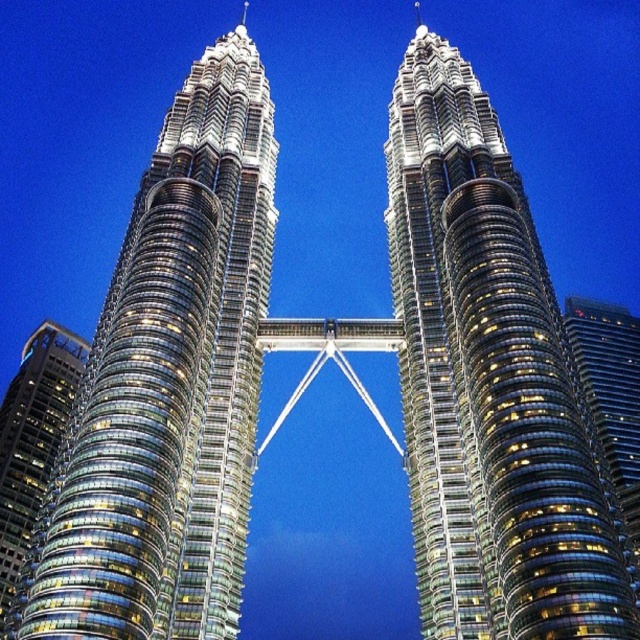
Question: Which point is farther to the camera?

Choices:
 (A) (36, 416)
 (B) (227, 388)
 (C) (406, 88)

Answer: (A)

Question: Is glassy metallic skyscraper at center above glassy steel skyscraper at center?

Choices:
 (A) no
 (B) yes

Answer: (B)

Question: Which object appears farthest from the camera in this image?

Choices:
 (A) glassy steel skyscraper at left
 (B) glassy steel skyscraper at center
 (C) glassy metallic skyscraper at center

Answer: (A)

Question: Which of the following is the farthest from the observer?

Choices:
 (A) glassy steel skyscraper at center
 (B) glassy steel skyscraper at left
 (C) glassy metallic skyscraper at center

Answer: (B)

Question: Can you confirm if glassy steel skyscraper at center is bigger than glassy steel skyscraper at left?

Choices:
 (A) yes
 (B) no

Answer: (B)

Question: Does glassy metallic skyscraper at center appear under glassy steel skyscraper at left?

Choices:
 (A) no
 (B) yes

Answer: (A)